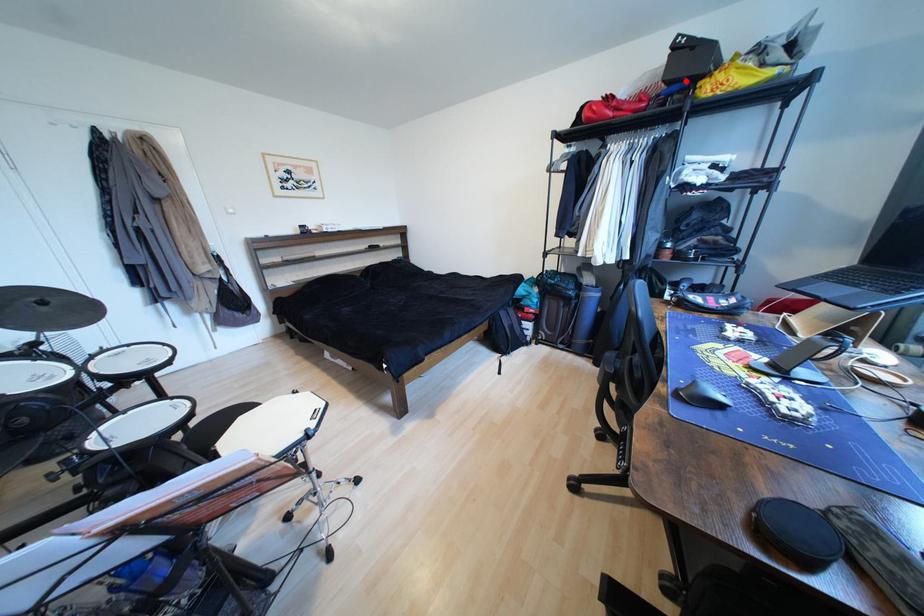
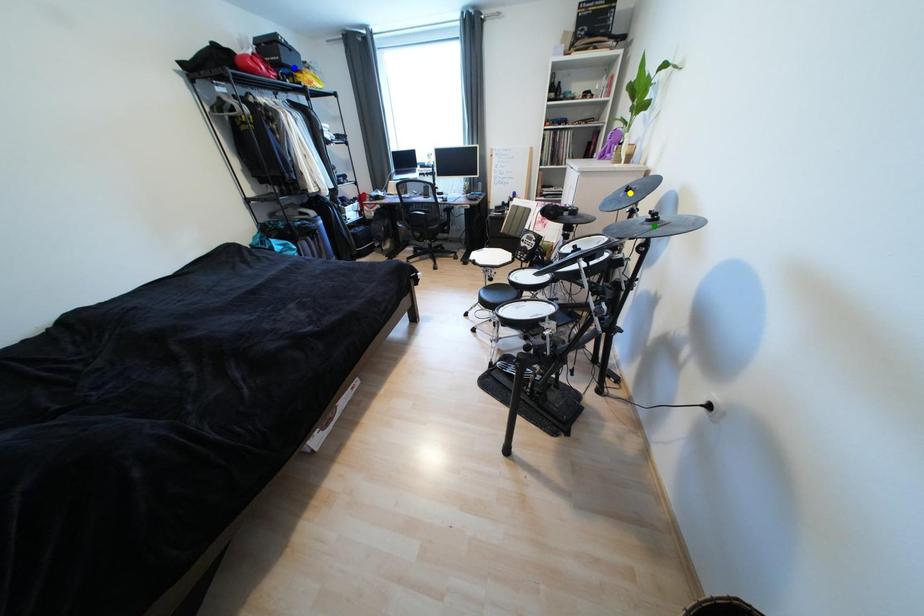
Question: I am providing you with two images of the same scene from different viewpoints. A red point is marked on the first image. You are given multiple points on the second image. Which mark in image 2 goes with the point in image 1?

Choices:
 (A) green point
 (B) yellow point
 (C) blue point

Answer: (C)